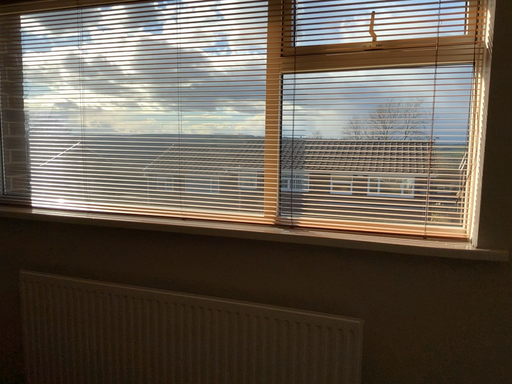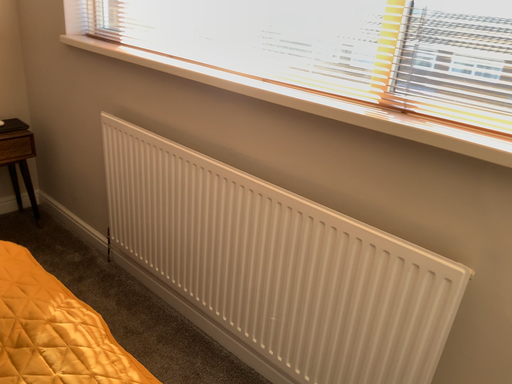
Question: Which way did the camera rotate in the video?

Choices:
 (A) rotated left
 (B) rotated right

Answer: (A)